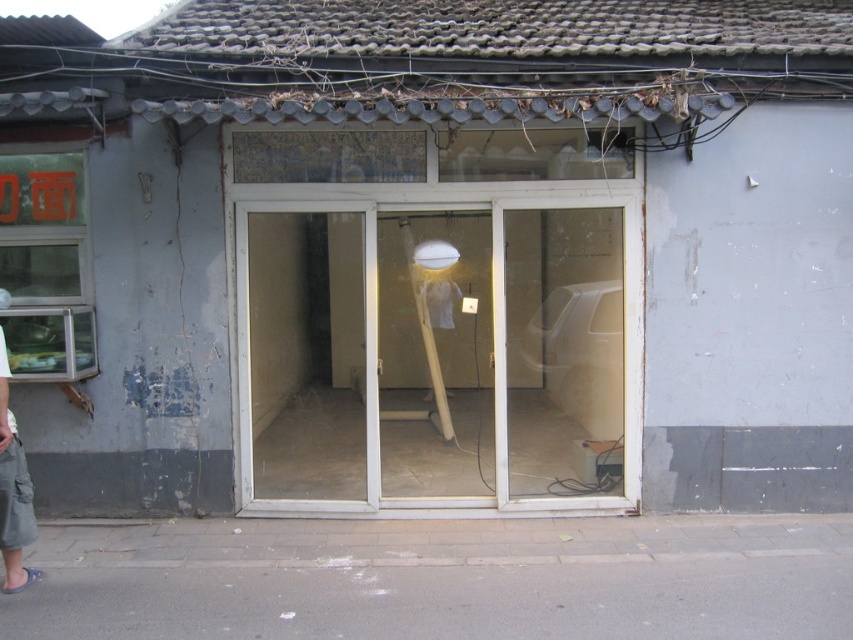
You are a delivery person trying to enter the store through the transparent plastic screen door at center. However, you are carrying a large gray cotton skirt at lower left. Will the skirt fit through the door without bending it?

The transparent plastic screen door at center is much taller than the gray cotton skirt at lower left, so the skirt can pass through the door without bending it as long as it is held vertically.